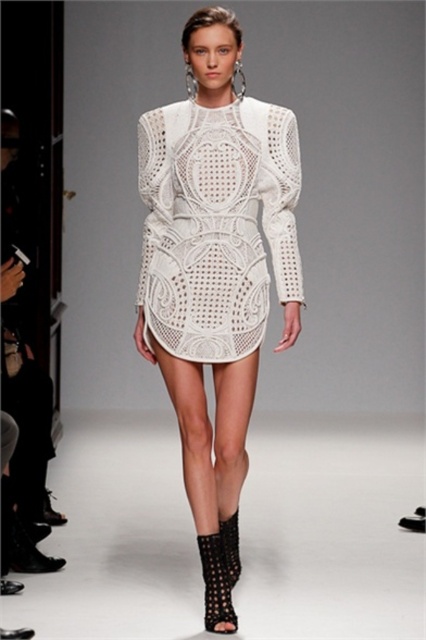
Question: Can you confirm if white textured dress at center is positioned below white lace dress at center?

Choices:
 (A) no
 (B) yes

Answer: (B)

Question: Considering the real-world distances, which object is closest to the black textured boot at lower center?

Choices:
 (A) white lace dress at center
 (B) black mesh boot at lower center
 (C) white textured dress at center

Answer: (B)

Question: Does white textured dress at center have a smaller size compared to black textured boot at lower center?

Choices:
 (A) no
 (B) yes

Answer: (A)

Question: Which object appears closest to the camera in this image?

Choices:
 (A) white textured dress at center
 (B) black textured boot at lower center
 (C) white lace dress at center

Answer: (B)

Question: Can you confirm if white textured dress at center is thinner than white lace dress at center?

Choices:
 (A) yes
 (B) no

Answer: (A)

Question: Which of the following is the closest to the observer?

Choices:
 (A) black mesh boot at lower center
 (B) white lace dress at center

Answer: (A)